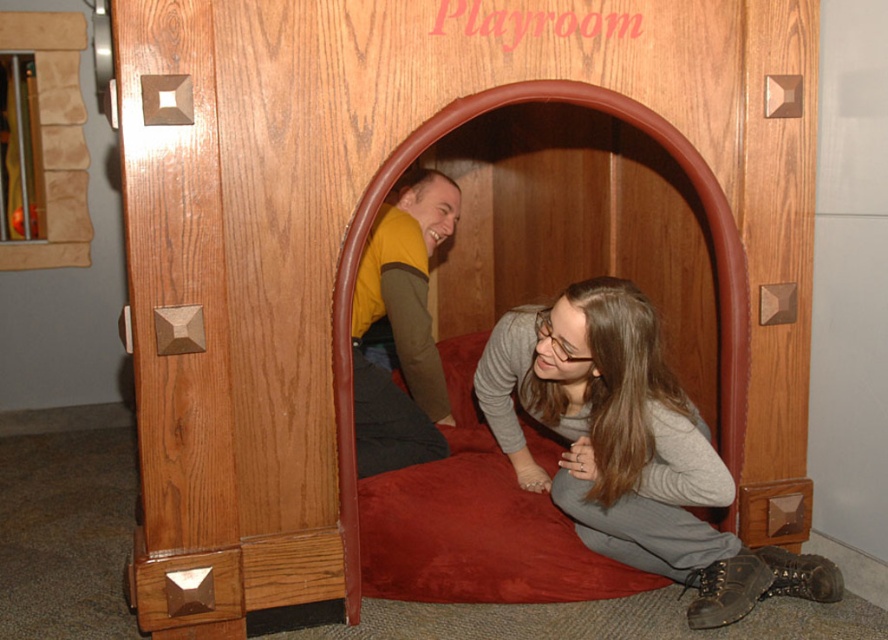
Question: Does gray fabric pants at lower right appear on the left side of yellow-green shirt at center?

Choices:
 (A) no
 (B) yes

Answer: (A)

Question: Among these points, which one is farthest from the camera?

Choices:
 (A) (629, 291)
 (B) (421, 266)

Answer: (B)

Question: Which of the following is the closest to the observer?

Choices:
 (A) gray fabric pants at lower right
 (B) yellow-green shirt at center

Answer: (A)

Question: Is gray fabric pants at lower right above yellow-green shirt at center?

Choices:
 (A) no
 (B) yes

Answer: (A)

Question: Which of the following is the farthest from the observer?

Choices:
 (A) (414, 202)
 (B) (629, 424)

Answer: (A)

Question: Does gray fabric pants at lower right appear under yellow-green shirt at center?

Choices:
 (A) yes
 (B) no

Answer: (A)